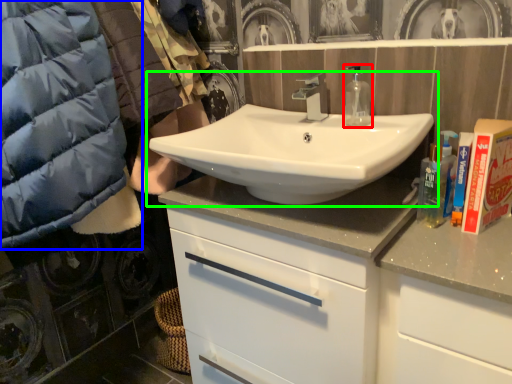
Question: Estimate the real-world distances between objects in this image. Which object is closer to mouthwash (highlighted by a red box), jacket (highlighted by a blue box) or sink (highlighted by a green box)?

Choices:
 (A) jacket
 (B) sink

Answer: (B)